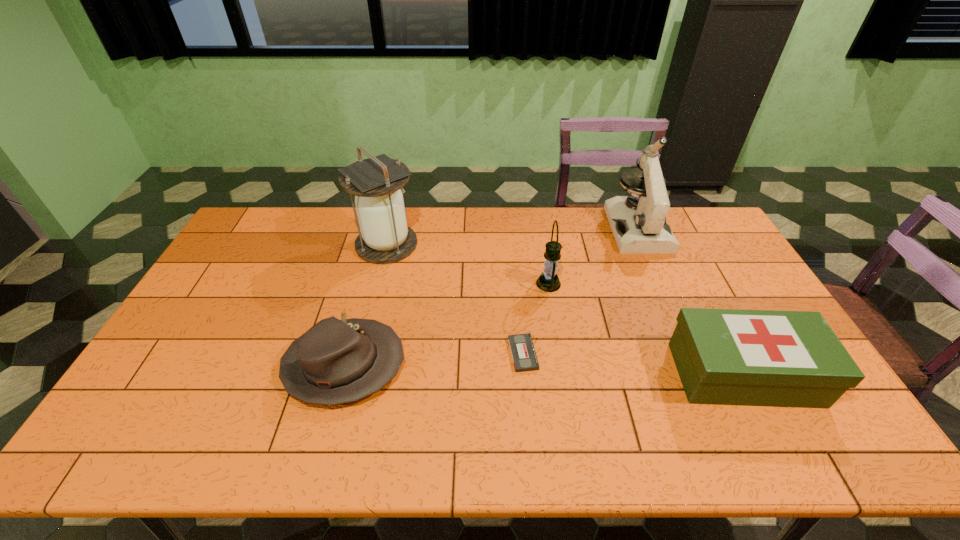
Where is `free spot located on the front of the taller lantern`? The width and height of the screenshot is (960, 540). free spot located on the front of the taller lantern is located at coordinates pyautogui.click(x=358, y=359).

Where is `vacant space situated 0.080m on the side where the right lantern emits light`? This screenshot has width=960, height=540. vacant space situated 0.080m on the side where the right lantern emits light is located at coordinates (511, 284).

Find the location of a particular element. This screenshot has height=540, width=960. vacant space located 0.360m on the side where the right lantern emits light is located at coordinates [424, 284].

Identify the location of vacant space located 0.170m on the side where the right lantern emits light. This screenshot has height=540, width=960. (483, 284).

This screenshot has height=540, width=960. Find the location of `vacant space situated on the left of the first-aid kit`. vacant space situated on the left of the first-aid kit is located at coordinates (565, 374).

You are a GUI agent. You are given a task and a screenshot of the screen. Output one action in this format:
    pyautogui.click(x=<x>, y=<y>)
    Task: Click on the vacant region located on the decorative side of the second shortest object
    Image resolution: width=960 pixels, height=540 pixels.
    Given the screenshot: What is the action you would take?
    pyautogui.click(x=427, y=365)

Identify the location of free region located 0.270m on the left of the videotape. This screenshot has height=540, width=960. (411, 354).

Find the location of a particular element. The image size is (960, 540). microscope situated at the far edge is located at coordinates (638, 222).

Find the location of `lantern positioned at the far edge`. lantern positioned at the far edge is located at coordinates pos(385,238).

Where is `object present at the right edge`? object present at the right edge is located at coordinates (723, 356).